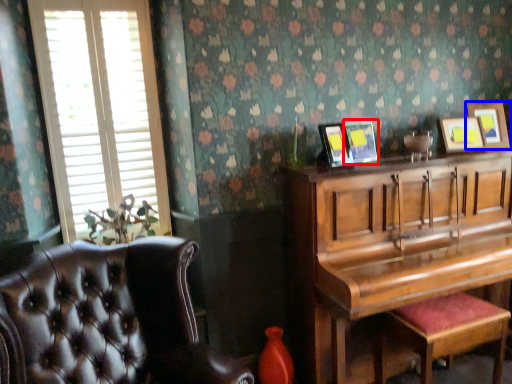
Question: Which object is closer to the camera taking this photo, picture frame (highlighted by a red box) or picture frame (highlighted by a blue box)?

Choices:
 (A) picture frame
 (B) picture frame

Answer: (A)